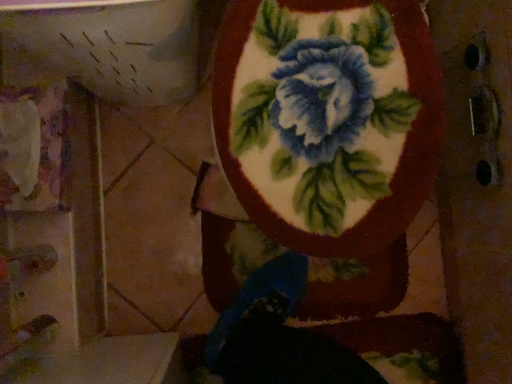
I want to click on floral carpet at center, so click(x=326, y=126).

What do you see at coordinates (326, 126) in the screenshot? The width and height of the screenshot is (512, 384). I see `floral carpet at center` at bounding box center [326, 126].

The height and width of the screenshot is (384, 512). Find the location of `floral carpet at center`. floral carpet at center is located at coordinates (326, 126).